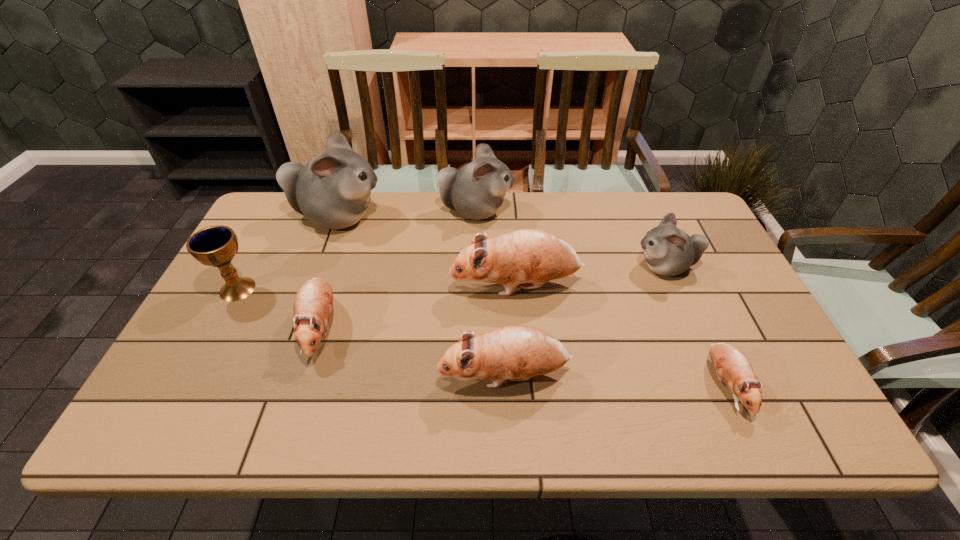
Identify the location of the shortest object. (731, 365).

Find the location of a particular element. the shortest hamster is located at coordinates (731, 365).

I want to click on free location located on the face of the tallest object, so click(x=403, y=218).

The width and height of the screenshot is (960, 540). What are the coordinates of `vacant space situated on the face of the second white hamster from left to right` in the screenshot? It's located at (622, 211).

Where is `free point located at the face of the biggest brown hamster`? This screenshot has height=540, width=960. free point located at the face of the biggest brown hamster is located at coordinates (385, 286).

At what (x,y) coordinates should I click in order to perform the action: click on vacant region located 0.090m at the face of the biggest brown hamster. Please return your answer as a coordinate pair (x, y). Looking at the image, I should click on (418, 286).

You are a GUI agent. You are given a task and a screenshot of the screen. Output one action in this format:
    pyautogui.click(x=<x>, y=<y>)
    Task: Click on the vacant area situated 0.070m at the face of the biggest brown hamster
    The height and width of the screenshot is (540, 960).
    Given the screenshot: What is the action you would take?
    pyautogui.click(x=425, y=286)

This screenshot has height=540, width=960. In order to click on free point located 0.200m on the front of the blue chalice in this screenshot , I will do `click(195, 369)`.

What are the coordinates of `free region located on the face of the nearest white hamster` in the screenshot? It's located at (536, 267).

At what (x,y) coordinates should I click in order to perform the action: click on vacant space located 0.210m on the face of the nearest white hamster. Please return your answer as a coordinate pair (x, y). Looking at the image, I should click on (560, 267).